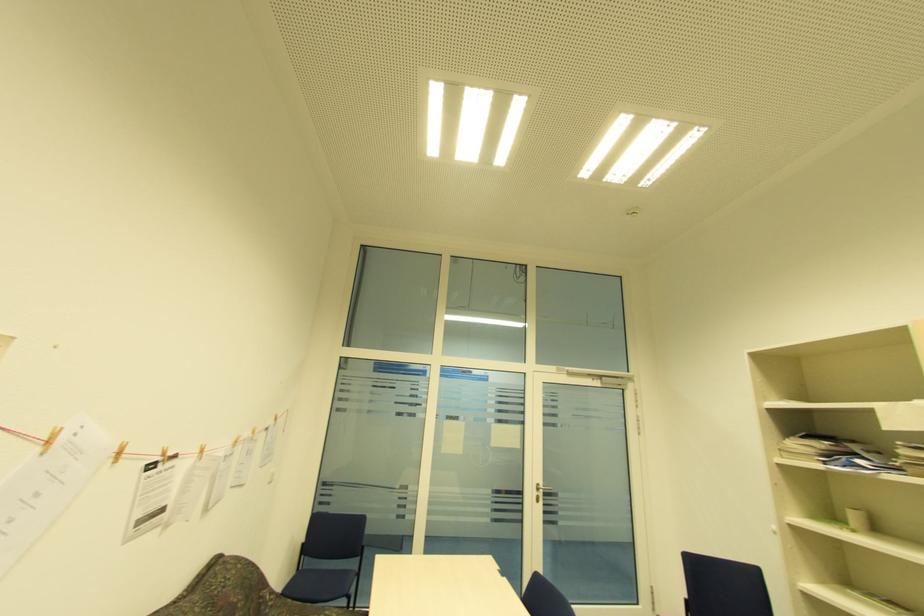
At what (x,y) coordinates should I click in order to perform the action: click on paper towel. Please return your answer as a coordinate pair (x, y). This screenshot has height=616, width=924. Looking at the image, I should click on (x=857, y=520).